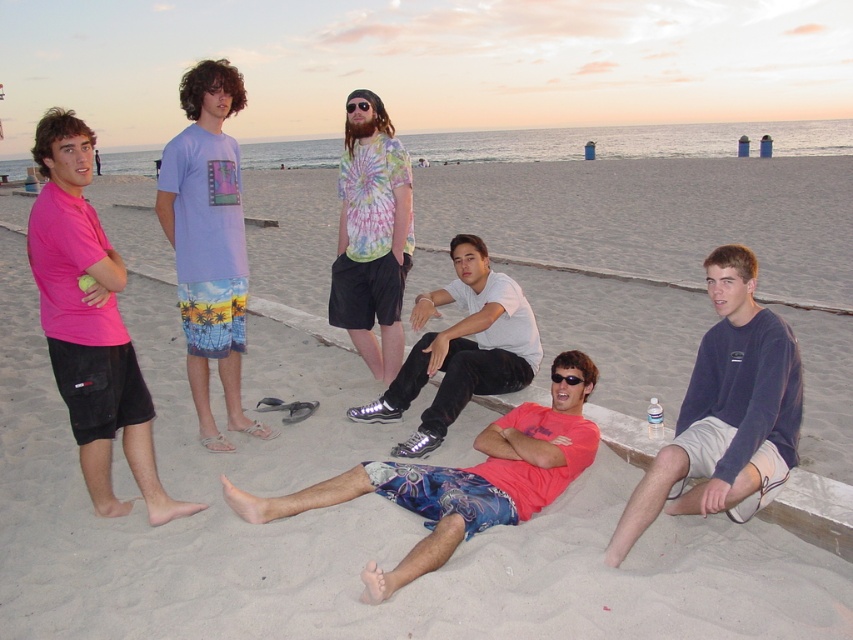
Looking at this image, is tie-dye fabric shirt at center taller than translucent plastic goggles at center?

Yes, tie-dye fabric shirt at center is taller than translucent plastic goggles at center.

Who is taller, tie-dye fabric shirt at center or translucent plastic goggles at center?

With more height is tie-dye fabric shirt at center.

Identify the location of tie-dye fabric shirt at center. (372, 237).

Is dark blue sweatshirt at center to the right of black reflective sunglasses at center from the viewer's perspective?

Yes, dark blue sweatshirt at center is to the right of black reflective sunglasses at center.

Is point (757, 401) less distant than point (550, 378)?

Yes, point (757, 401) is closer to viewer.

Find the location of a particular element. dark blue sweatshirt at center is located at coordinates (724, 412).

Is dark blue sweatshirt at center positioned in front of white matte shirt at center?

Yes, it is in front of white matte shirt at center.

Where is `dark blue sweatshirt at center`? This screenshot has width=853, height=640. dark blue sweatshirt at center is located at coordinates (724, 412).